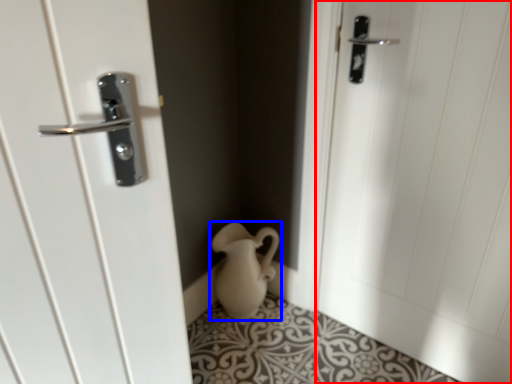
Question: Which object is further to the camera taking this photo, door (highlighted by a red box) or jug (highlighted by a blue box)?

Choices:
 (A) door
 (B) jug

Answer: (B)